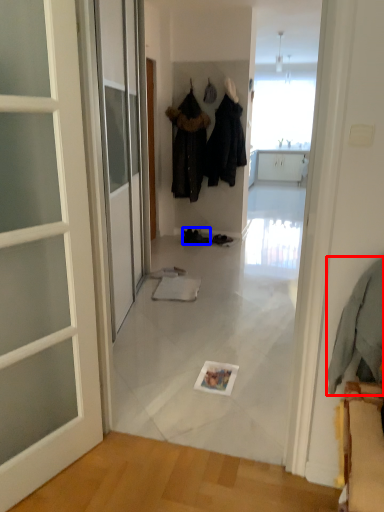
Question: Among these objects, which one is farthest to the camera, clothing (highlighted by a red box) or footwear (highlighted by a blue box)?

Choices:
 (A) clothing
 (B) footwear

Answer: (B)